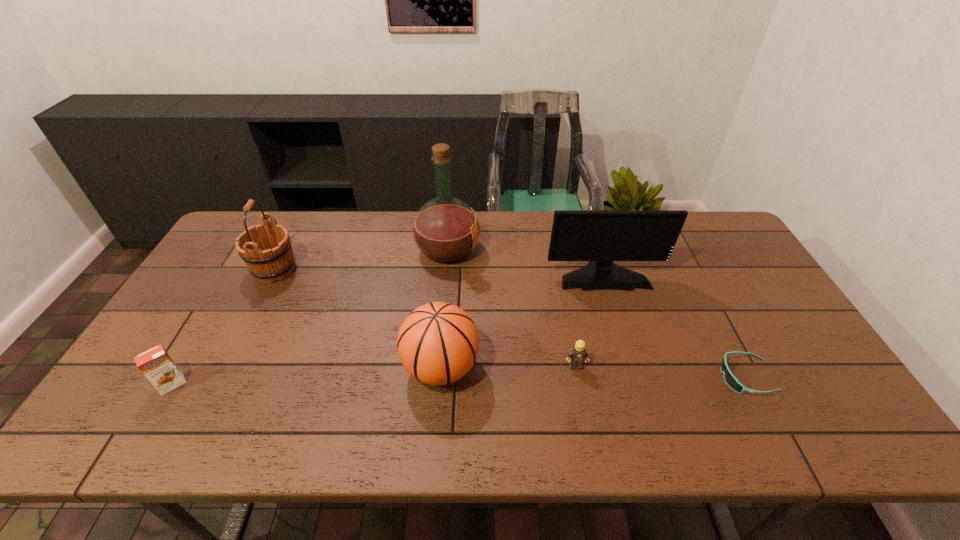
Where is `vacant space that's between the orange juice and the tallest object`? The image size is (960, 540). vacant space that's between the orange juice and the tallest object is located at coordinates (310, 317).

Where is `unoccupied area between the basketball and the second shortest object`? unoccupied area between the basketball and the second shortest object is located at coordinates (508, 367).

Locate an element on the screen. free space that is in between the shortest object and the wine bucket is located at coordinates (510, 323).

Choose which object is the third nearest neighbor to the fourth shortest object. Please provide its 2D coordinates. Your answer should be formatted as a tuple, i.e. [(x, y)], where the tuple contains the x and y coordinates of a point satisfying the conditions above.

[(600, 236)]

At what (x,y) coordinates should I click in order to perform the action: click on object that stands as the fifth closest to the orange juice. Please return your answer as a coordinate pair (x, y). Looking at the image, I should click on (600, 236).

You are a GUI agent. You are given a task and a screenshot of the screen. Output one action in this format:
    pyautogui.click(x=<x>, y=<y>)
    Task: Click on the free space that satisfies the following two spatial constraints: 1. on the front label of the basketball; 2. on the left side of the liquor
    This screenshot has width=960, height=540.
    Given the screenshot: What is the action you would take?
    pyautogui.click(x=438, y=367)